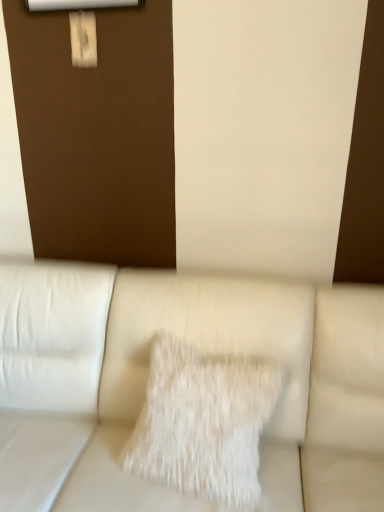
Locate an element on the screen. This screenshot has width=384, height=512. white fluffy pillow at center is located at coordinates (203, 423).

The height and width of the screenshot is (512, 384). What do you see at coordinates (203, 423) in the screenshot?
I see `white fluffy pillow at center` at bounding box center [203, 423].

What do you see at coordinates (202, 351) in the screenshot?
I see `white leather couch at center` at bounding box center [202, 351].

Measure the distance between white leather couch at center and camera.

They are 1.15 meters apart.

What is the approximate height of white leather couch at center?

white leather couch at center is 90.96 centimeters tall.

Find the location of a particular element. The width and height of the screenshot is (384, 512). white leather couch at center is located at coordinates (202, 351).

Find the location of a particular element. white fluffy pillow at center is located at coordinates (203, 423).

In the image, is white fluffy pillow at center on the left side or the right side of white leather couch at center?

white fluffy pillow at center is positioned on white leather couch at center's right side.

Is white fluffy pillow at center in front of white leather couch at center?

No, white fluffy pillow at center is further to the viewer.

Considering the positions of point (181, 381) and point (383, 406), is point (181, 381) closer or farther from the camera than point (383, 406)?

Point (181, 381) appears to be closer to the viewer than point (383, 406).

From the image's perspective, between white fluffy pillow at center and white leather couch at center, which one is located above?

From the image's view, white fluffy pillow at center is above.

From a real-world perspective, which is physically below, white fluffy pillow at center or white leather couch at center?

In real-world perspective, white leather couch at center is lower.

Consider the image. Considering the sizes of objects white fluffy pillow at center and white leather couch at center in the image provided, who is thinner, white fluffy pillow at center or white leather couch at center?

white fluffy pillow at center is thinner.

Which of these two, white fluffy pillow at center or white leather couch at center, stands taller?

With more height is white leather couch at center.

Does white fluffy pillow at center have a smaller size compared to white leather couch at center?

Yes, white fluffy pillow at center is smaller than white leather couch at center.

Is white fluffy pillow at center spatially inside white leather couch at center, or outside of it?

white fluffy pillow at center can be found inside white leather couch at center.

Is white fluffy pillow at center directly adjacent to white leather couch at center?

No, white fluffy pillow at center is not making contact with white leather couch at center.

Is white fluffy pillow at center aimed at white leather couch at center?

Yes.

How much distance is there between white fluffy pillow at center and white leather couch at center?

white fluffy pillow at center is 16.88 centimeters away from white leather couch at center.

Where is `pillow located on the right of white leather couch at center`? This screenshot has height=512, width=384. pillow located on the right of white leather couch at center is located at coordinates (203, 423).

Looking at this image, does white leather couch at center appear on the left side of white fluffy pillow at center?

Correct, you'll find white leather couch at center to the left of white fluffy pillow at center.

Does white leather couch at center lie behind white fluffy pillow at center?

No, white leather couch at center is closer to the camera.

Is point (10, 383) closer to viewer compared to point (252, 470)?

No, (10, 383) is further to viewer.

From the image's perspective, would you say white leather couch at center is positioned over white fluffy pillow at center?

Incorrect, from the image's perspective, white leather couch at center is lower than white fluffy pillow at center.

From a real-world perspective, is white leather couch at center positioned above or below white fluffy pillow at center?

In terms of real-world spatial position, white leather couch at center is below white fluffy pillow at center.

Which of these two, white leather couch at center or white fluffy pillow at center, is thinner?

Thinner between the two is white fluffy pillow at center.

Does white leather couch at center have a lesser height compared to white fluffy pillow at center?

No.

Based on their sizes in the image, would you say white leather couch at center is bigger or smaller than white fluffy pillow at center?

white leather couch at center is bigger than white fluffy pillow at center.

Is white leather couch at center completely or partially outside of white fluffy pillow at center?

Yes.

Would you say white leather couch at center is a long distance from white fluffy pillow at center?

white leather couch at center is near white fluffy pillow at center, not far away.

Does white leather couch at center turn towards white fluffy pillow at center?

Yes, white leather couch at center faces towards white fluffy pillow at center.

What's the angular difference between white leather couch at center and white fluffy pillow at center's facing directions?

There is a 3.34e-05-degree angle between the facing directions of white leather couch at center and white fluffy pillow at center.

How distant is white leather couch at center from white fluffy pillow at center?

white leather couch at center is 6.64 inches away from white fluffy pillow at center.

This screenshot has height=512, width=384. I want to click on pillow positioned vertically above the white leather couch at center (from a real-world perspective), so click(203, 423).

Find the location of a particular element. This screenshot has width=384, height=512. pillow behind the white leather couch at center is located at coordinates (203, 423).

The width and height of the screenshot is (384, 512). I want to click on pillow on the right of white leather couch at center, so click(203, 423).